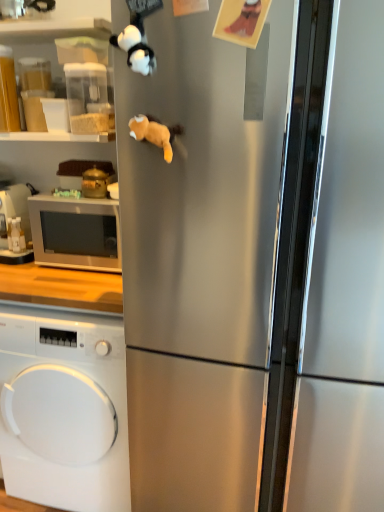
Question: Considering the relative sizes of gold metallic pot at left, the 1th appliance in the right-to-left sequence, and white glossy microwave at left in the image provided, is gold metallic pot at left, the 1th appliance in the right-to-left sequence, shorter than white glossy microwave at left?

Choices:
 (A) yes
 (B) no

Answer: (A)

Question: Is the depth of gold metallic pot at left, the 1th appliance in the right-to-left sequence, greater than that of white glossy microwave at left?

Choices:
 (A) yes
 (B) no

Answer: (A)

Question: Is gold metallic pot at left, the 2th appliance positioned from the left, outside white glossy microwave at left?

Choices:
 (A) yes
 (B) no

Answer: (A)

Question: From the image's perspective, is gold metallic pot at left, the 2th appliance positioned from the left, over white glossy microwave at left?

Choices:
 (A) no
 (B) yes

Answer: (B)

Question: Would you consider gold metallic pot at left, the 1th appliance from the front, to be distant from white glossy microwave at left?

Choices:
 (A) no
 (B) yes

Answer: (A)

Question: In terms of width, does white glossy microwave at left look wider or thinner when compared to white plush panda at upper left, arranged as the 2th animal when ordered from the bottom?

Choices:
 (A) thin
 (B) wide

Answer: (B)

Question: From a real-world perspective, is white glossy microwave at left above or below white plush panda at upper left, the first animal in the top-to-bottom sequence?

Choices:
 (A) above
 (B) below

Answer: (B)

Question: In terms of height, does white glossy microwave at left look taller or shorter compared to white plush panda at upper left, arranged as the 2th animal when ordered from the bottom?

Choices:
 (A) tall
 (B) short

Answer: (A)

Question: Does point (66, 221) appear closer or farther from the camera than point (117, 41)?

Choices:
 (A) closer
 (B) farther

Answer: (B)

Question: Is white glossy microwave at left inside or outside of matte black microwave at left, the 1th appliance viewed from the left?

Choices:
 (A) inside
 (B) outside

Answer: (B)

Question: In terms of height, does white glossy microwave at left look taller or shorter compared to matte black microwave at left, placed as the second appliance when sorted from front to back?

Choices:
 (A) tall
 (B) short

Answer: (A)

Question: Looking at the image, does white glossy microwave at left seem bigger or smaller compared to matte black microwave at left, placed as the second appliance when sorted from right to left?

Choices:
 (A) small
 (B) big

Answer: (B)

Question: Looking at their shapes, would you say white glossy microwave at left is wider or thinner than matte black microwave at left, arranged as the 1th appliance when viewed from the back?

Choices:
 (A) thin
 (B) wide

Answer: (B)

Question: Is satin silver refrigerator at center taller or shorter than white plush panda at upper left, the first animal in the top-to-bottom sequence?

Choices:
 (A) short
 (B) tall

Answer: (B)

Question: From a real-world perspective, is satin silver refrigerator at center physically located above or below white plush panda at upper left, arranged as the 2th animal when ordered from the bottom?

Choices:
 (A) above
 (B) below

Answer: (B)